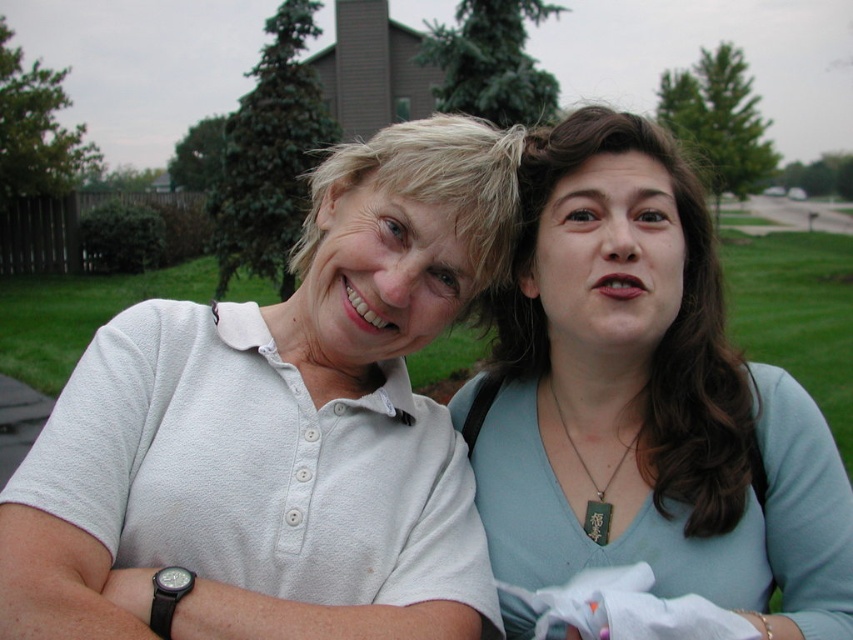
Who is positioned more to the left, white matte shirt at left or matte white shirt at upper left?

white matte shirt at left is more to the left.

Who is shorter, white matte shirt at left or matte white shirt at upper left?

white matte shirt at left is shorter.

Does point (111, 529) come in front of point (480, 429)?

Yes, point (111, 529) is in front of point (480, 429).

Locate an element on the screen. white matte shirt at left is located at coordinates (282, 413).